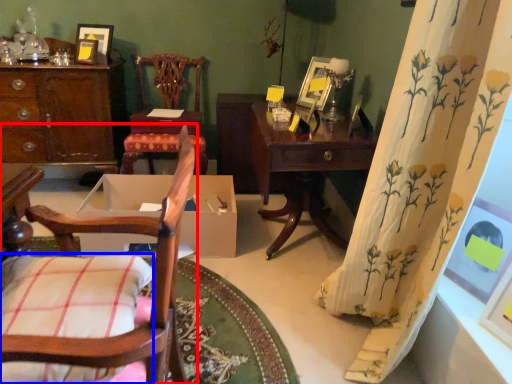
Question: Which of the following is the farthest to the observer, chair (highlighted by a red box) or pillow (highlighted by a blue box)?

Choices:
 (A) chair
 (B) pillow

Answer: (B)